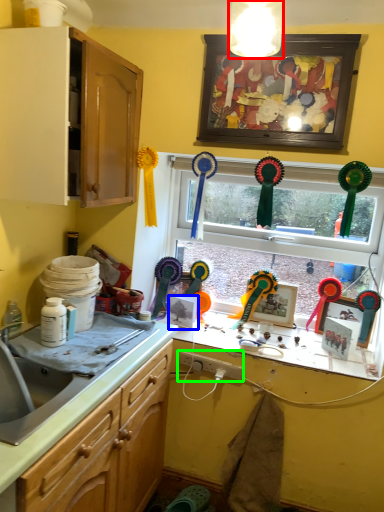
Question: Estimate the real-world distances between objects in this image. Which object is closer to light fixture (highlighted by a red box), picture frame (highlighted by a blue box) or plug (highlighted by a green box)?

Choices:
 (A) picture frame
 (B) plug

Answer: (B)